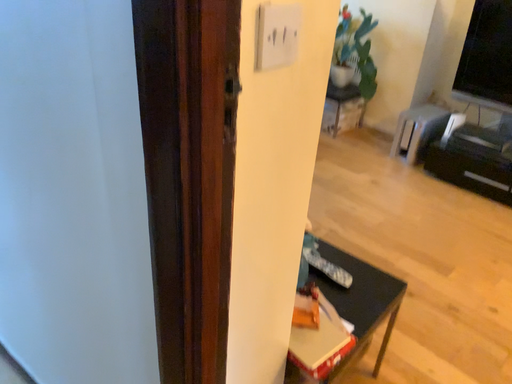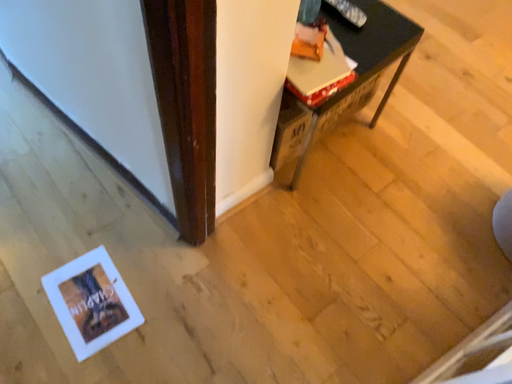
Question: Which way did the camera rotate in the video?

Choices:
 (A) rotated downward
 (B) rotated upward

Answer: (A)